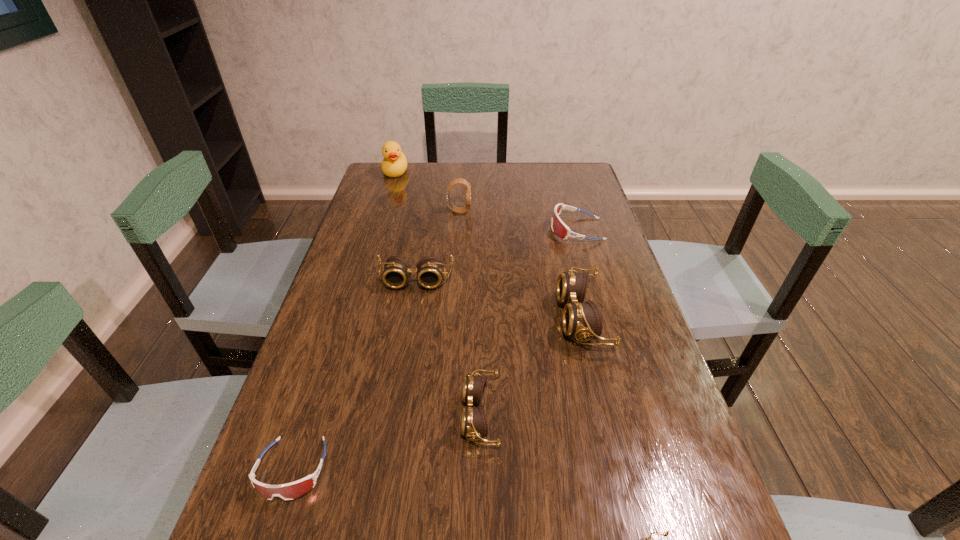
You are a GUI agent. You are given a task and a screenshot of the screen. Output one action in this format:
    pyautogui.click(x=<x>, y=<y>)
    Task: Click on the free region located on the front-facing side of the bigger red goggles
    
    Given the screenshot: What is the action you would take?
    pyautogui.click(x=462, y=230)

Image resolution: width=960 pixels, height=540 pixels. Identify the location of free spot located on the front-facing side of the bigger red goggles. (443, 230).

At what (x,y) coordinates should I click in order to perform the action: click on free location located 0.300m through the lenses of the second nearest brown goggles. Please return your answer as a coordinate pair (x, y). This screenshot has height=540, width=960. Looking at the image, I should click on (315, 414).

Identify the location of vacant space located through the lenses of the second nearest brown goggles. (324, 414).

The height and width of the screenshot is (540, 960). Find the location of `vacant space located 0.360m through the lenses of the second nearest brown goggles`. vacant space located 0.360m through the lenses of the second nearest brown goggles is located at coordinates (285, 414).

At what (x,y) coordinates should I click in order to perform the action: click on object that is at the far edge. Please return your answer as a coordinate pair (x, y). This screenshot has width=960, height=540. Looking at the image, I should click on (394, 164).

I want to click on duck at the left edge, so click(394, 164).

I want to click on object that is at the far left corner, so click(x=394, y=164).

Locate an element on the screen. vacant space at the far edge of the desktop is located at coordinates (462, 166).

I want to click on vacant space at the left edge of the desktop, so click(318, 315).